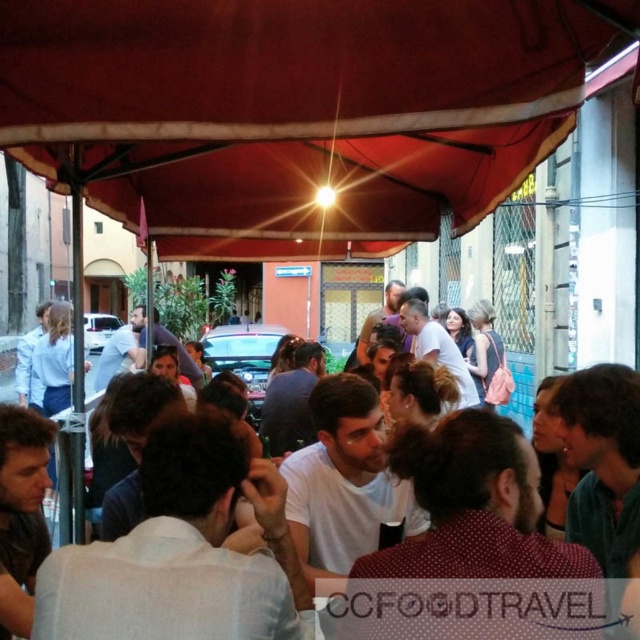
Question: Which of the following is the closest to the observer?

Choices:
 (A) red fabric canopy at center
 (B) white cotton shirt at center

Answer: (B)

Question: Is red fabric canopy at center positioned at the back of white cotton shirt at center?

Choices:
 (A) yes
 (B) no

Answer: (A)

Question: Can you confirm if red fabric canopy at center is positioned to the left of white cotton shirt at center?

Choices:
 (A) yes
 (B) no

Answer: (A)

Question: Among these points, which one is farthest from the camera?

Choices:
 (A) (401, 582)
 (B) (236, 88)

Answer: (B)

Question: Is red fabric canopy at center positioned at the back of white cotton shirt at center?

Choices:
 (A) yes
 (B) no

Answer: (A)